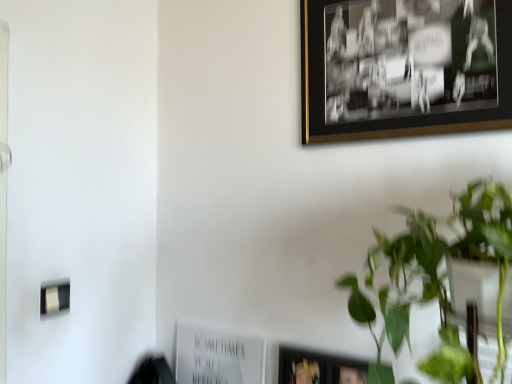
Question: Can you confirm if white paper at lower center, the first picture frame from the left, is thinner than green leafy plant at upper right?

Choices:
 (A) yes
 (B) no

Answer: (A)

Question: From a real-world perspective, is white paper at lower center, which ranks as the first picture frame in back-to-front order, below green leafy plant at upper right?

Choices:
 (A) no
 (B) yes

Answer: (B)

Question: Is white paper at lower center, the second picture frame when ordered from front to back, oriented towards green leafy plant at upper right?

Choices:
 (A) no
 (B) yes

Answer: (A)

Question: From the image's perspective, would you say white paper at lower center, the second picture frame when ordered from front to back, is shown under green leafy plant at upper right?

Choices:
 (A) yes
 (B) no

Answer: (A)

Question: Does white paper at lower center, marked as the second picture frame in a top-to-bottom arrangement, appear on the left side of green leafy plant at upper right?

Choices:
 (A) no
 (B) yes

Answer: (B)

Question: In terms of width, does black/golden frame at upper right, acting as the second picture frame starting from the left, look wider or thinner when compared to white paper at lower center, which is the first picture frame in bottom-to-top order?

Choices:
 (A) thin
 (B) wide

Answer: (A)

Question: Relative to white paper at lower center, marked as the second picture frame in a top-to-bottom arrangement, is black/golden frame at upper right, which is the 1th picture frame in top-to-bottom order, in front or behind?

Choices:
 (A) front
 (B) behind

Answer: (A)

Question: From their relative heights in the image, would you say black/golden frame at upper right, which ranks as the second picture frame in back-to-front order, is taller or shorter than white paper at lower center, marked as the second picture frame in a top-to-bottom arrangement?

Choices:
 (A) tall
 (B) short

Answer: (A)

Question: Choose the correct answer: Is black/golden frame at upper right, which is the second picture frame from bottom to top, inside white paper at lower center, the first picture frame from the left, or outside it?

Choices:
 (A) inside
 (B) outside

Answer: (B)

Question: Is point (219, 357) positioned closer to the camera than point (338, 112)?

Choices:
 (A) closer
 (B) farther

Answer: (B)

Question: Based on their positions, is white paper at lower center, the second picture frame when ordered from front to back, located to the left or right of black/golden frame at upper right, acting as the second picture frame starting from the left?

Choices:
 (A) left
 (B) right

Answer: (A)

Question: Choose the correct answer: Is white paper at lower center, marked as the second picture frame in a top-to-bottom arrangement, inside black/golden frame at upper right, the 1th picture frame viewed from the right, or outside it?

Choices:
 (A) outside
 (B) inside

Answer: (A)

Question: In the image, is white paper at lower center, marked as the second picture frame in a top-to-bottom arrangement, positioned in front of or behind black/golden frame at upper right, which ranks as the second picture frame in back-to-front order?

Choices:
 (A) front
 (B) behind

Answer: (B)

Question: Considering the positions of green leafy plant at upper right and black/golden frame at upper right, the 1th picture frame viewed from the right, in the image, is green leafy plant at upper right wider or thinner than black/golden frame at upper right, the 1th picture frame viewed from the right,?

Choices:
 (A) thin
 (B) wide

Answer: (B)

Question: Based on their sizes in the image, would you say green leafy plant at upper right is bigger or smaller than black/golden frame at upper right, which is the 1th picture frame in top-to-bottom order?

Choices:
 (A) big
 (B) small

Answer: (A)